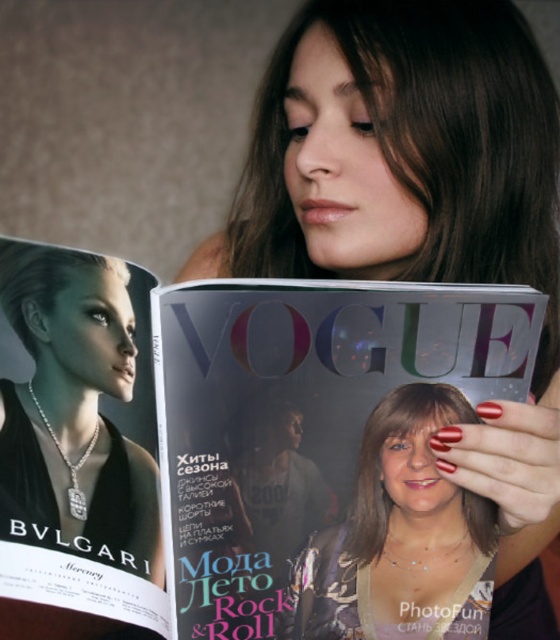
You are a photographer setting up a shoot. You have two magazines, a matte silver magazine at center and a matte black magazine at center. The client wants to ensure the silver magazine is the focal point. Based on the scene, which magazine is positioned closer to the camera?

The matte silver magazine at center is in front of the matte black magazine at center, making it closer to the camera and thus the focal point.

You are a photographer setting up for a photoshoot. You have a matte black magazine at center and a matte silver necklace at center in front of you. You need to place them side by side on a shelf. Which object should you place first if you want to ensure there is enough space for both?

The matte black magazine at center is wider than the matte silver necklace at center. Therefore, you should place the matte black magazine at center first to ensure there is enough space for both items on the shelf.